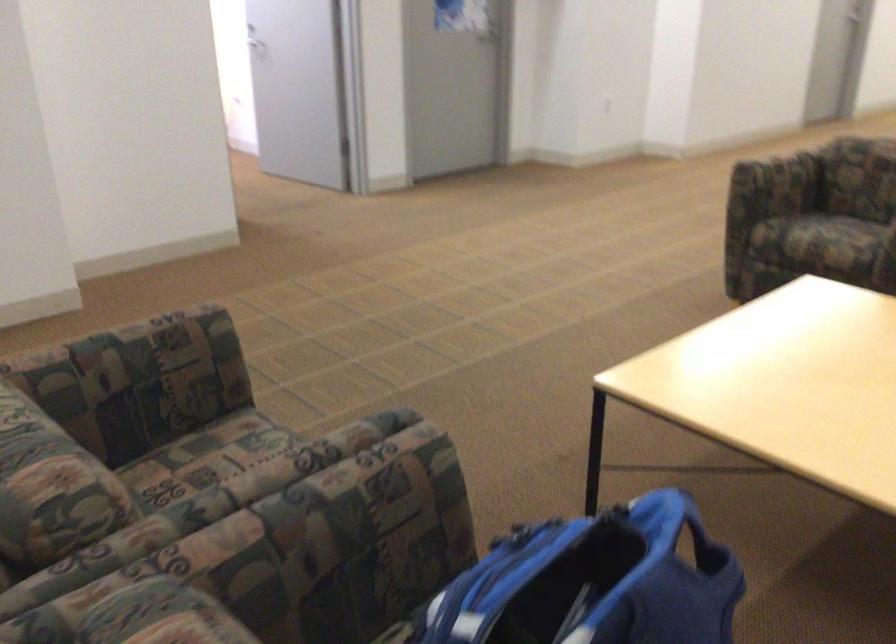
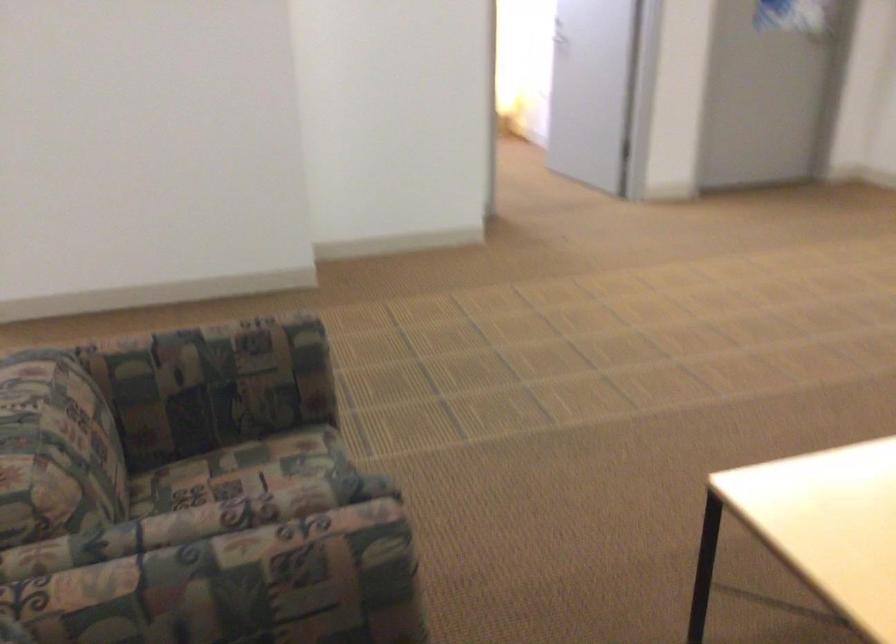
Locate, in the second image, the point that corresponds to point (212, 453) in the first image.

(254, 468)